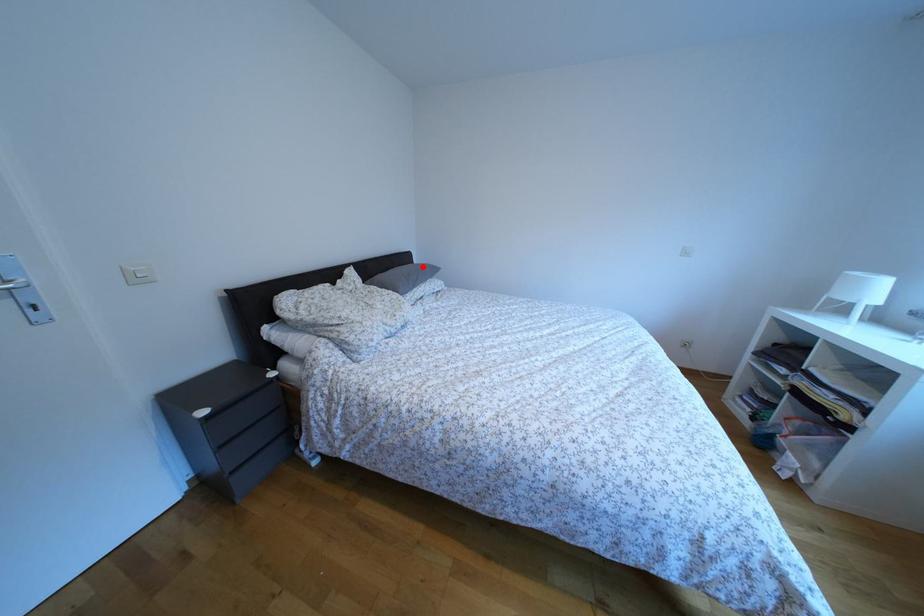
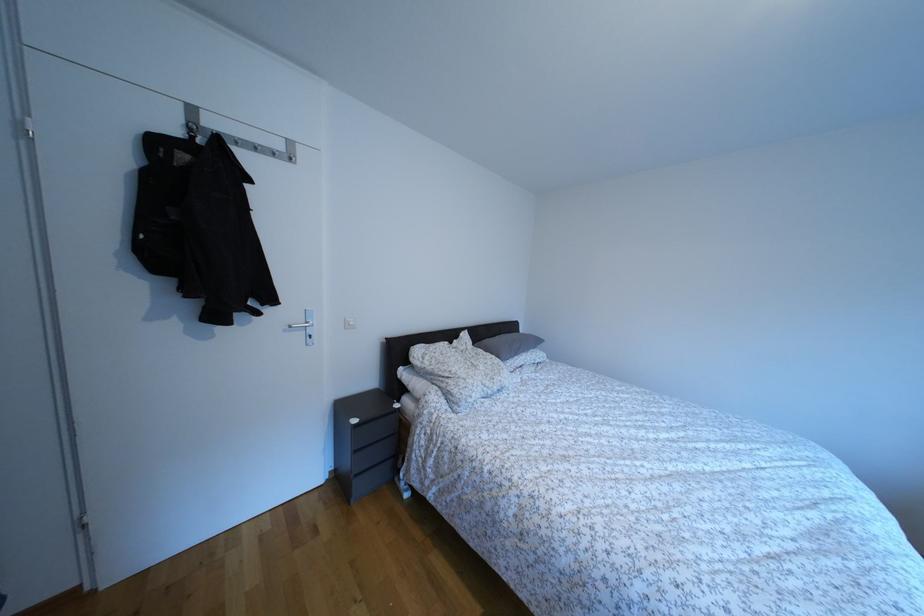
Where in the second image is the point corresponding to the highlighted location from the first image?

(529, 336)